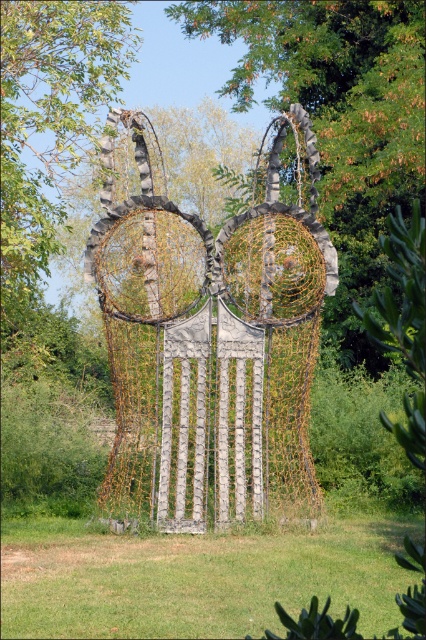
Question: Among these objects, which one is farthest from the camera?

Choices:
 (A) rusty wire mesh sculpture at center
 (B) green leafy tree at center

Answer: (B)

Question: Which point is closer to the camera taking this photo?

Choices:
 (A) (347, 193)
 (B) (20, 150)
 (C) (144, 244)

Answer: (C)

Question: Does green leafy tree at center appear on the left side of green leafy tree at upper center?

Choices:
 (A) no
 (B) yes

Answer: (A)

Question: Is rusty wire mesh sculpture at center further to camera compared to green leafy tree at upper center?

Choices:
 (A) no
 (B) yes

Answer: (B)

Question: Where is green leafy tree at center located in relation to green leafy tree at upper center in the image?

Choices:
 (A) above
 (B) below

Answer: (A)

Question: Among these points, which one is farthest from the camera?

Choices:
 (A) (120, 10)
 (B) (131, 474)

Answer: (B)